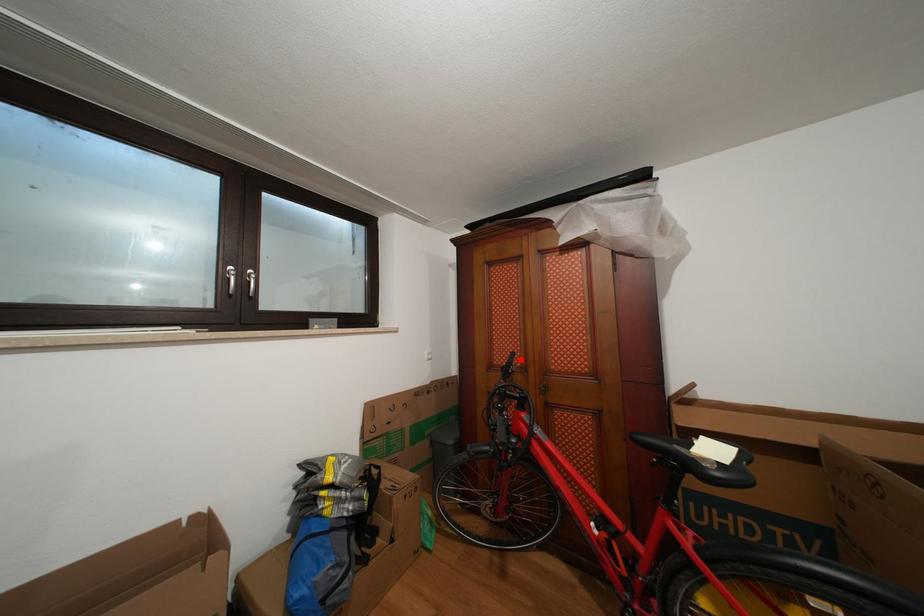
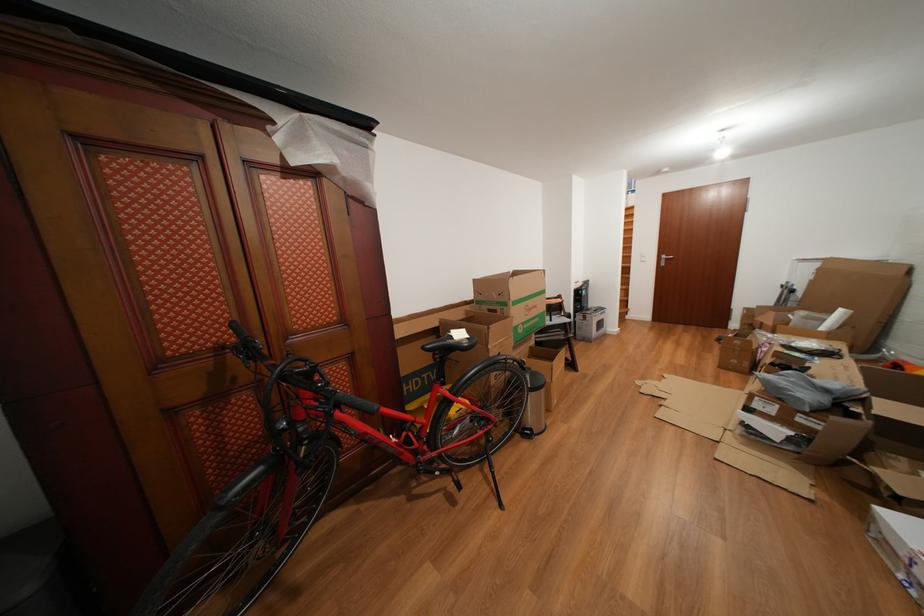
Find the pixel in the second image that matches the highlighted location in the first image.

(241, 330)